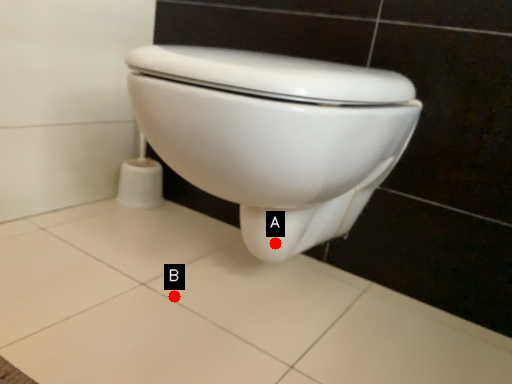
Question: Two points are circled on the image, labeled by A and B beside each circle. Which point is farther to the camera?

Choices:
 (A) A is further
 (B) B is further

Answer: (B)